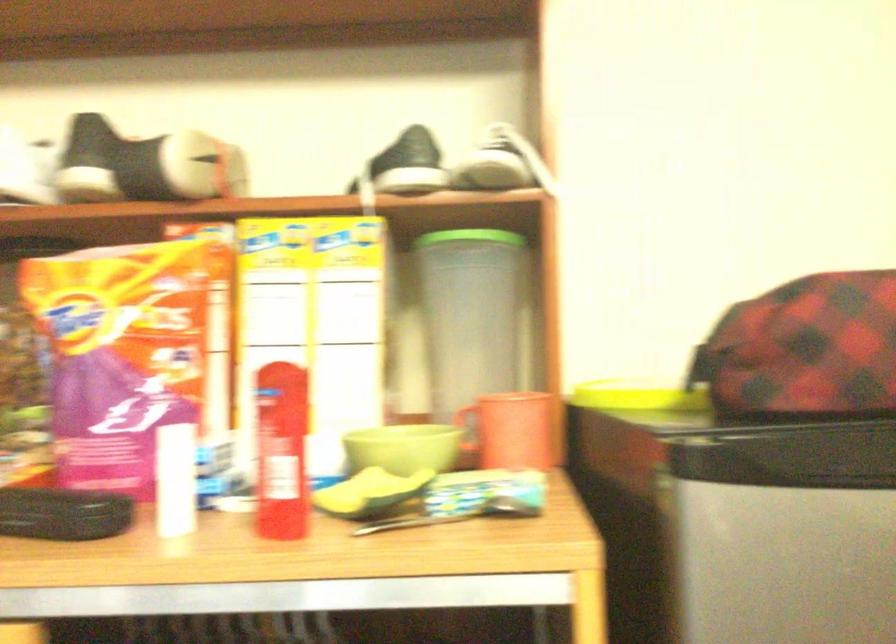
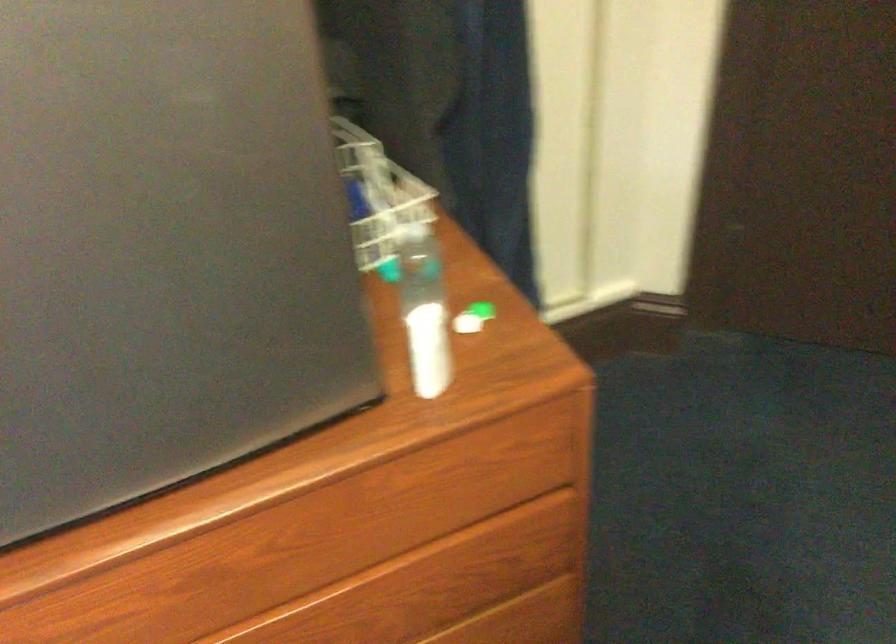
The first image is from the beginning of the video and the second image is from the end. How did the camera likely rotate when shooting the video?

The rotation direction of the camera is right-down.